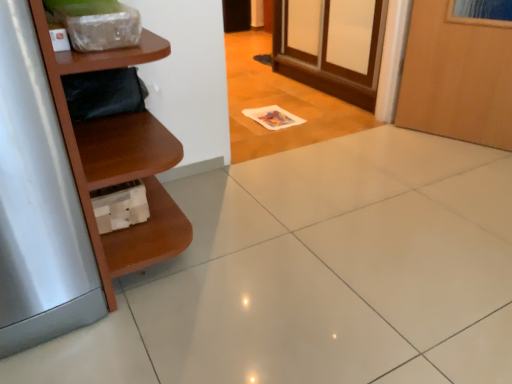
Question: Considering the relative sizes of brown wood shelf at left and brushed metal refrigerator at left in the image provided, is brown wood shelf at left thinner than brushed metal refrigerator at left?

Choices:
 (A) no
 (B) yes

Answer: (B)

Question: Is brown wood shelf at left wider than brushed metal refrigerator at left?

Choices:
 (A) no
 (B) yes

Answer: (A)

Question: Can you confirm if brown wood shelf at left is smaller than brushed metal refrigerator at left?

Choices:
 (A) no
 (B) yes

Answer: (A)

Question: From the image's perspective, is brown wood shelf at left over brushed metal refrigerator at left?

Choices:
 (A) yes
 (B) no

Answer: (A)

Question: Is brown wood shelf at left directly adjacent to brushed metal refrigerator at left?

Choices:
 (A) yes
 (B) no

Answer: (B)

Question: From a real-world perspective, does brown wood shelf at left stand above brushed metal refrigerator at left?

Choices:
 (A) yes
 (B) no

Answer: (A)

Question: Would you say brown wood shelf at left is part of brushed metal refrigerator at left's contents?

Choices:
 (A) no
 (B) yes

Answer: (A)

Question: Is brushed metal refrigerator at left smaller than brown wood shelf at left?

Choices:
 (A) yes
 (B) no

Answer: (A)

Question: Is brushed metal refrigerator at left closer to camera compared to brown wood shelf at left?

Choices:
 (A) no
 (B) yes

Answer: (B)

Question: Is brushed metal refrigerator at left outside brown wood shelf at left?

Choices:
 (A) yes
 (B) no

Answer: (A)

Question: From the image's perspective, is brushed metal refrigerator at left below brown wood shelf at left?

Choices:
 (A) no
 (B) yes

Answer: (B)

Question: Are brushed metal refrigerator at left and brown wood shelf at left located far from each other?

Choices:
 (A) yes
 (B) no

Answer: (B)

Question: Is brown wood shelf at left inside the boundaries of brushed metal refrigerator at left, or outside?

Choices:
 (A) inside
 (B) outside

Answer: (B)